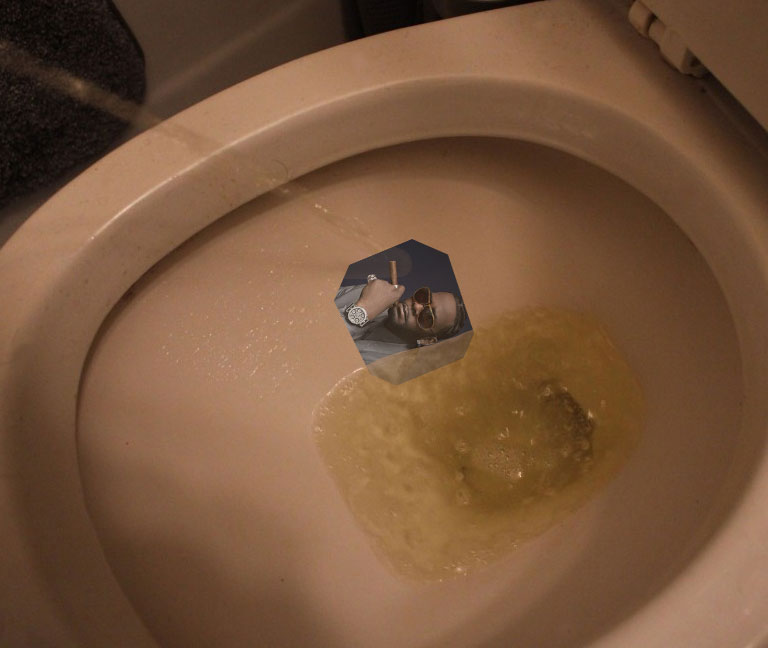
I want to click on hinge, so click(x=672, y=52).